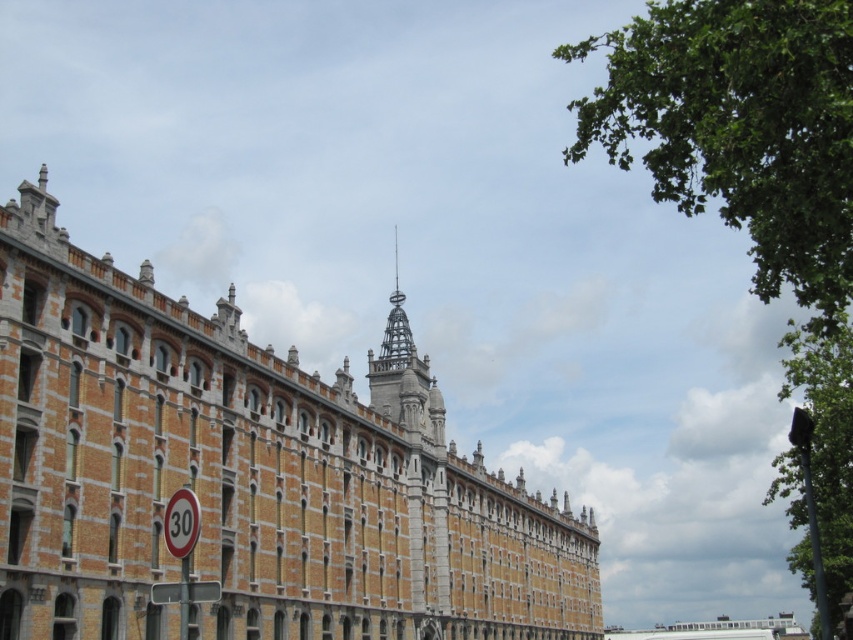
You are standing in front of the historic building and notice two points marked on the facade. The first point is located at coordinates point (187, 548), and the second is at point (219, 589). Which of these points is closer to you as you face the building?

Point (187, 548) is in front of point (219, 589), so it is closer to you as you face the building.

You are standing in front of the historic building and notice two points marked on the tower. The first point is at coordinate point (325, 545) and the second at point (183, 547). Which point is closer to you?

Point (183, 547) is closer to you because it is less further to the camera than point (325, 545).

Based on the photo, you are driving a car and see the metallic yellow speed limit sign at lower left and the white plastic sign at lower left ahead on the road. Which sign will you reach first?

The metallic yellow speed limit sign at lower left is closer to the viewer than the white plastic sign at lower left, so you will reach the metallic yellow speed limit sign at lower left first.